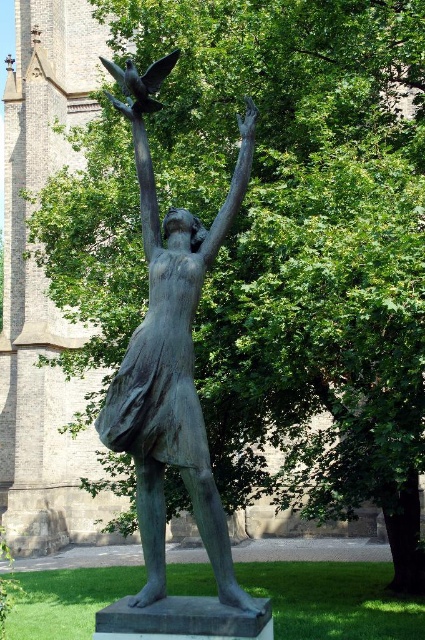
Question: Does bronze statue at center have a lesser width compared to shiny black bird at upper center?

Choices:
 (A) no
 (B) yes

Answer: (A)

Question: Can you confirm if bronze statue at center is positioned above shiny black bird at upper center?

Choices:
 (A) yes
 (B) no

Answer: (B)

Question: Among these objects, which one is farthest from the camera?

Choices:
 (A) bronze statue at center
 (B) shiny black bird at upper center

Answer: (B)

Question: Among these points, which one is nearest to the camera?

Choices:
 (A) (189, 467)
 (B) (159, 83)

Answer: (A)

Question: Can you confirm if bronze statue at center is thinner than shiny black bird at upper center?

Choices:
 (A) yes
 (B) no

Answer: (B)